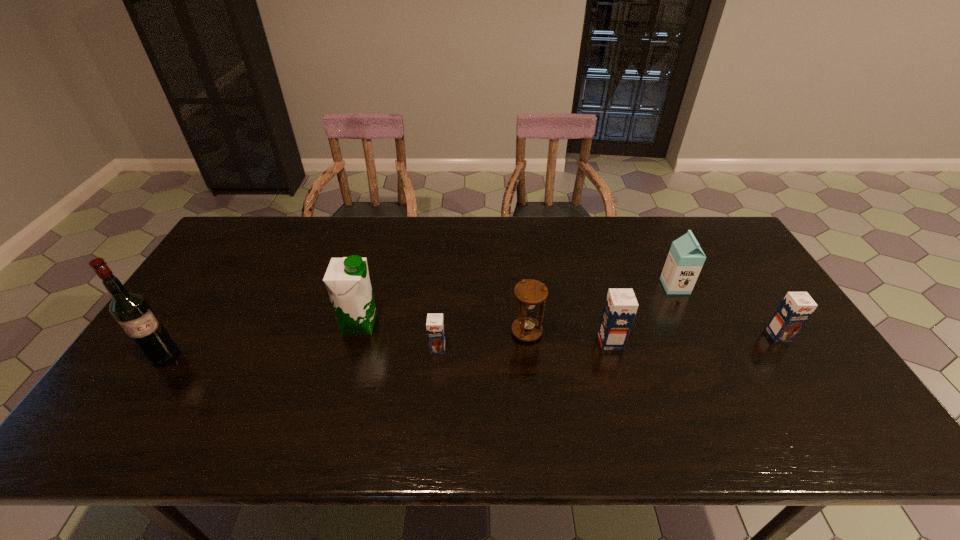
The image size is (960, 540). Identify the location of object that is at the left edge. (131, 310).

What are the coordinates of `object that is at the right edge` in the screenshot? It's located at (796, 308).

In the image, there is a desktop. Where is `vacant space at the far edge`? The width and height of the screenshot is (960, 540). vacant space at the far edge is located at coordinates tap(316, 242).

Locate an element on the screen. The height and width of the screenshot is (540, 960). free space at the near edge is located at coordinates (682, 407).

Where is `blank space at the left edge of the desktop`? The image size is (960, 540). blank space at the left edge of the desktop is located at coordinates (257, 265).

Identify the location of vacant region at the far left corner of the desktop. (262, 233).

Where is `vacant region at the far right corner of the desktop`? This screenshot has width=960, height=540. vacant region at the far right corner of the desktop is located at coordinates (735, 239).

At what (x,y) coordinates should I click in order to perform the action: click on free point between the rightmost chocolate milk and the tallest object. Please return your answer as a coordinate pair (x, y). Image resolution: width=960 pixels, height=540 pixels. Looking at the image, I should click on [x=472, y=346].

Where is `free space between the hourglass and the milk carton`? free space between the hourglass and the milk carton is located at coordinates (601, 309).

At what (x,y) coordinates should I click in order to perform the action: click on free spot between the hourglass and the third object from right to left. Please return your answer as a coordinate pair (x, y). This screenshot has width=960, height=540. Looking at the image, I should click on (568, 337).